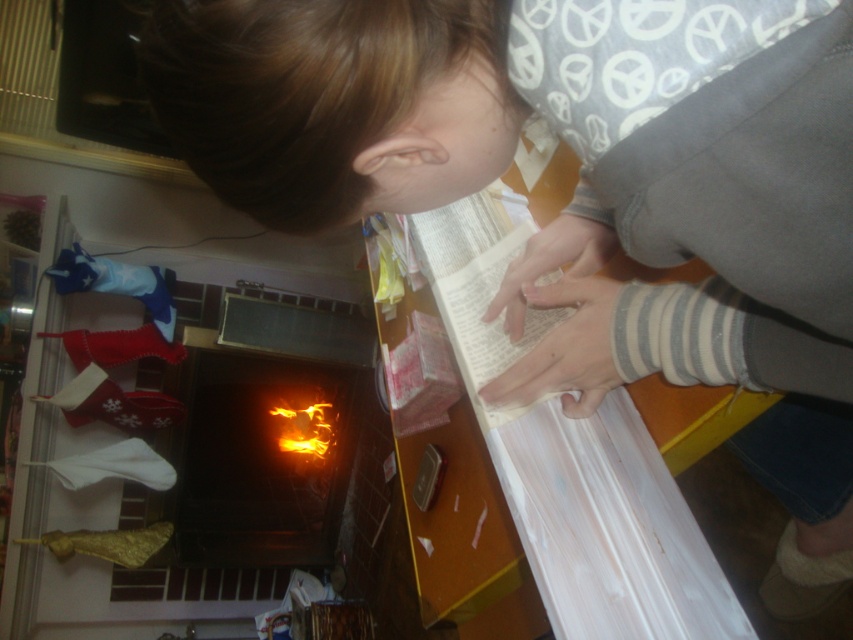
Can you confirm if brick fireplace at lower left is positioned to the right of orange glowing fire at center?

No, brick fireplace at lower left is not to the right of orange glowing fire at center.

Between brick fireplace at lower left and orange glowing fire at center, which one has less height?

orange glowing fire at center is shorter.

This screenshot has width=853, height=640. I want to click on brick fireplace at lower left, so click(254, 477).

I want to click on brick fireplace at lower left, so click(254, 477).